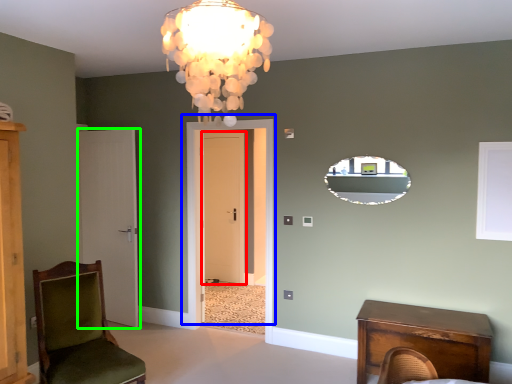
Question: Which object is positioned closest to door (highlighted by a red box)? Select from door (highlighted by a blue box) and door (highlighted by a green box).

Choices:
 (A) door
 (B) door

Answer: (A)